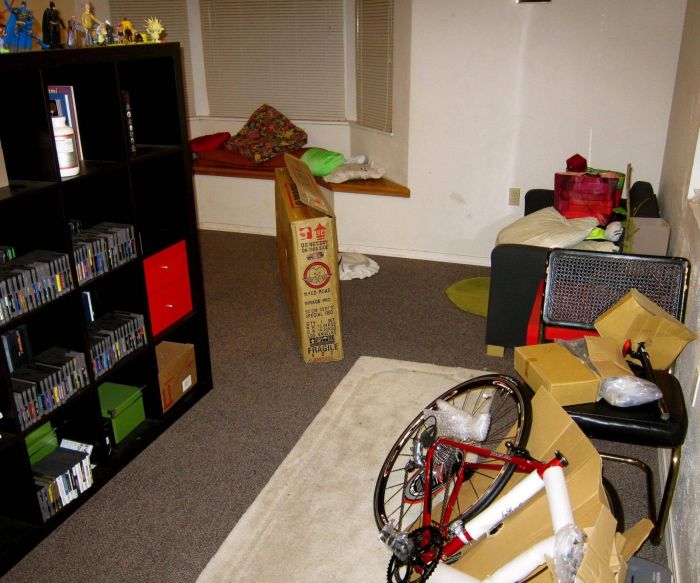
Locate an element on the screen. black chair is located at coordinates pyautogui.click(x=600, y=283).